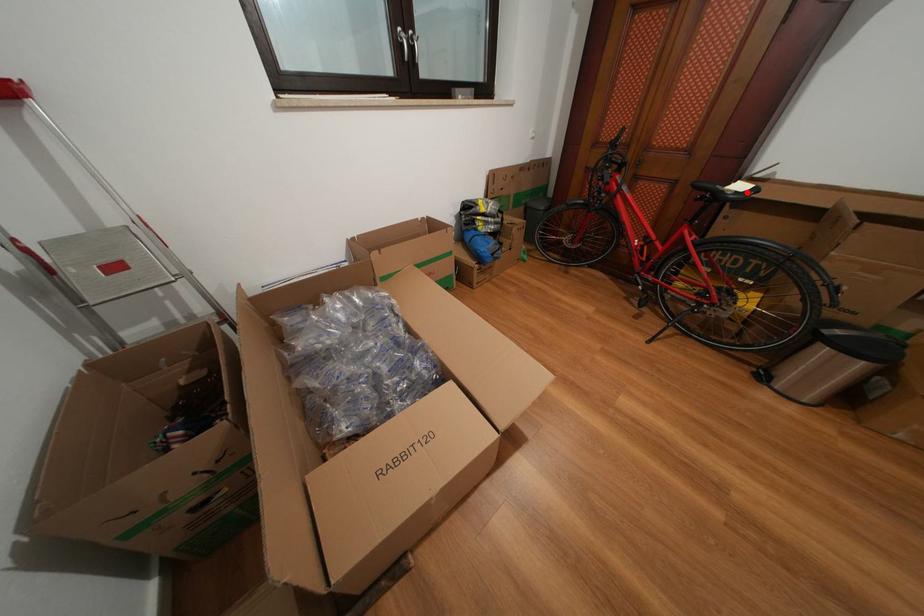
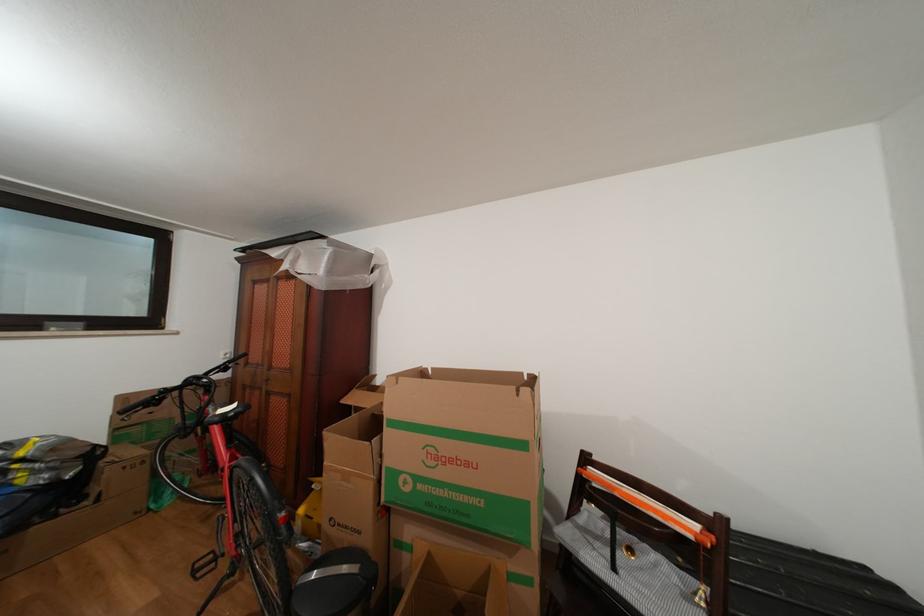
In the second image, find the point that corresponds to the highlighted location in the first image.

(237, 413)